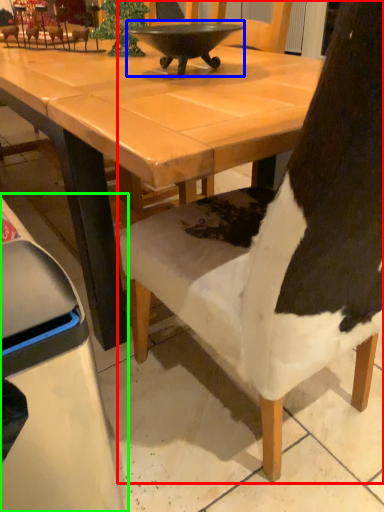
Question: Estimate the real-world distances between objects in this image. Which object is closer to chair (highlighted by a red box), bowl (highlighted by a blue box) or chair (highlighted by a green box)?

Choices:
 (A) bowl
 (B) chair

Answer: (B)